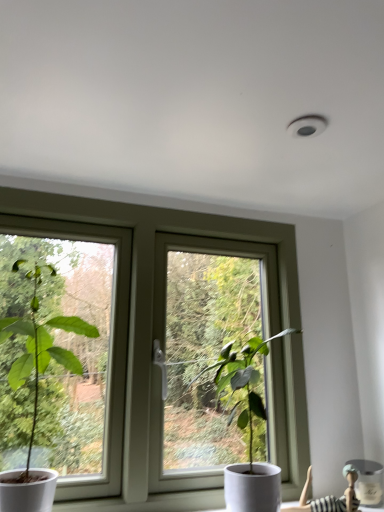
Question: From a real-world perspective, is white ceramic vase at lower right positioned above or below striped fabric doll at lower right?

Choices:
 (A) above
 (B) below

Answer: (B)

Question: Is white ceramic vase at lower right wider or thinner than striped fabric doll at lower right?

Choices:
 (A) thin
 (B) wide

Answer: (B)

Question: Based on their relative distances, which object is farther from the green matte plant at left, which is the 1th houseplant in left-to-right order?

Choices:
 (A) white plastic window at center
 (B) green matte plant at center, arranged as the 2th houseplant when viewed from the left
 (C) striped fabric doll at lower right
 (D) white ceramic vase at lower right

Answer: (D)

Question: Considering the real-world distances, which object is closest to the white plastic window at center?

Choices:
 (A) white ceramic vase at lower right
 (B) striped fabric doll at lower right
 (C) green matte plant at left, which is the 1th houseplant in left-to-right order
 (D) green matte plant at center, which is the first houseplant from right to left

Answer: (D)